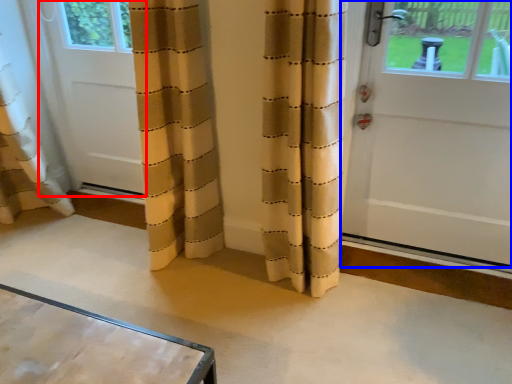
Question: Which of the following is the farthest to the observer, door (highlighted by a red box) or door (highlighted by a blue box)?

Choices:
 (A) door
 (B) door

Answer: (A)